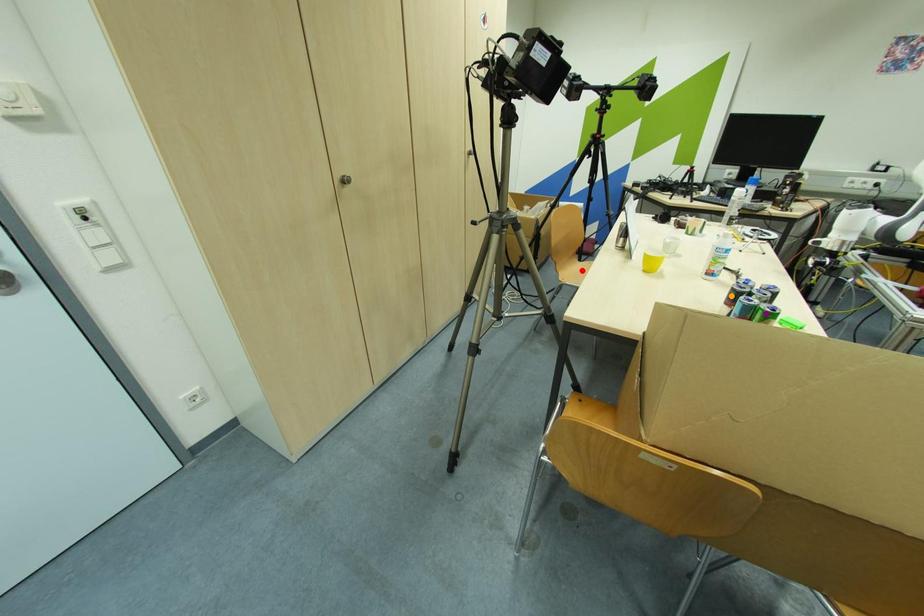
Order these from nearest to farthest:
purple point, red point, orange point

red point, orange point, purple point